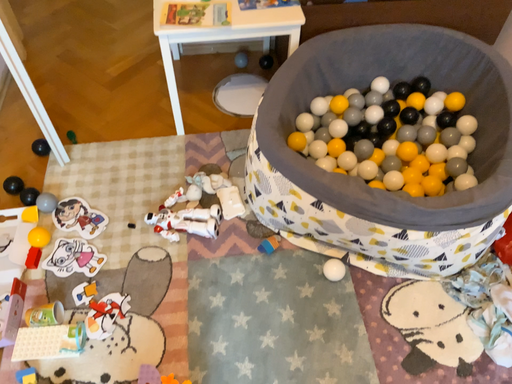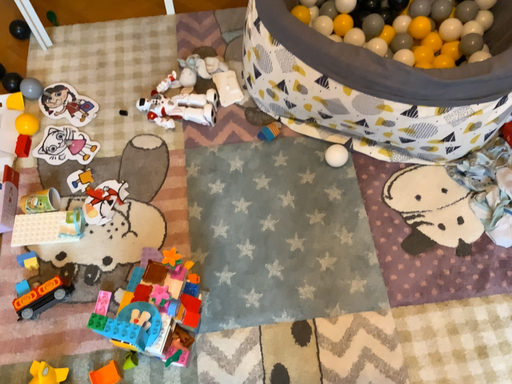
Question: Which way did the camera rotate in the video?

Choices:
 (A) rotated downward
 (B) rotated upward

Answer: (A)